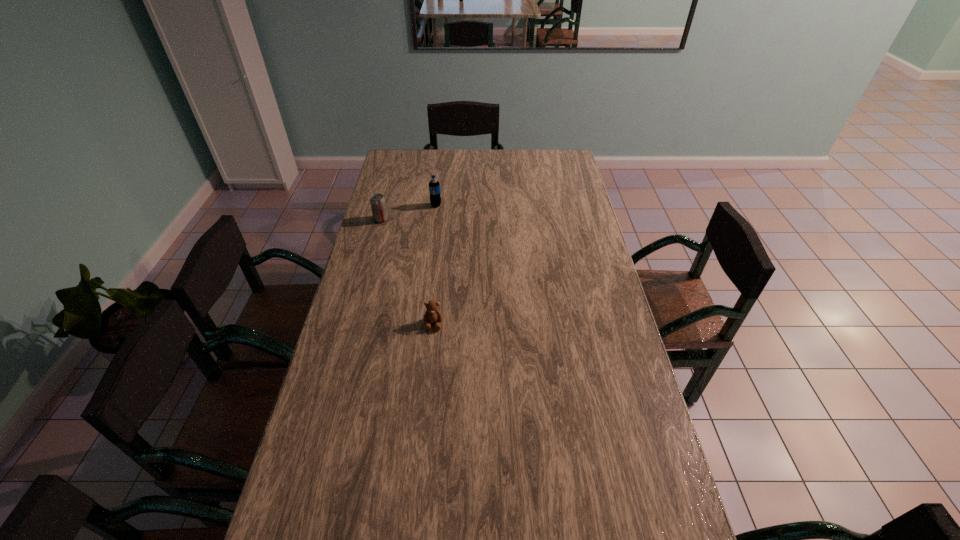
Image resolution: width=960 pixels, height=540 pixels. In order to click on the farther soda can in this screenshot , I will do point(434,186).

This screenshot has height=540, width=960. Find the location of `the tallest object`. the tallest object is located at coordinates (434, 186).

Find the location of `the nearer soda can`. the nearer soda can is located at coordinates (378, 205).

Locate an element on the screen. The image size is (960, 540). the second tallest object is located at coordinates (378, 205).

You are a GUI agent. You are given a task and a screenshot of the screen. Output one action in this format:
    pyautogui.click(x=<x>, y=<y>)
    Task: Click on the teddy bear
    The image size is (960, 540).
    Given the screenshot: What is the action you would take?
    pyautogui.click(x=432, y=315)

You are a GUI agent. You are given a task and a screenshot of the screen. Output one action in this format:
    pyautogui.click(x=<x>, y=<y>)
    Task: Click on the nearest object
    
    Given the screenshot: What is the action you would take?
    pyautogui.click(x=432, y=315)

Where is `free space located on the right of the right soda can`? This screenshot has width=960, height=540. free space located on the right of the right soda can is located at coordinates (458, 205).

This screenshot has height=540, width=960. In order to click on vacant space situated 0.330m on the back of the leftmost object in this screenshot , I will do `click(394, 173)`.

You are a GUI agent. You are given a task and a screenshot of the screen. Output one action in this format:
    pyautogui.click(x=<x>, y=<y>)
    Task: Click on the free space located 0.170m on the face of the shortest object
    The image size is (960, 540).
    Given the screenshot: What is the action you would take?
    pyautogui.click(x=428, y=378)

The image size is (960, 540). Find the location of `object situated at the left edge`. object situated at the left edge is located at coordinates (378, 205).